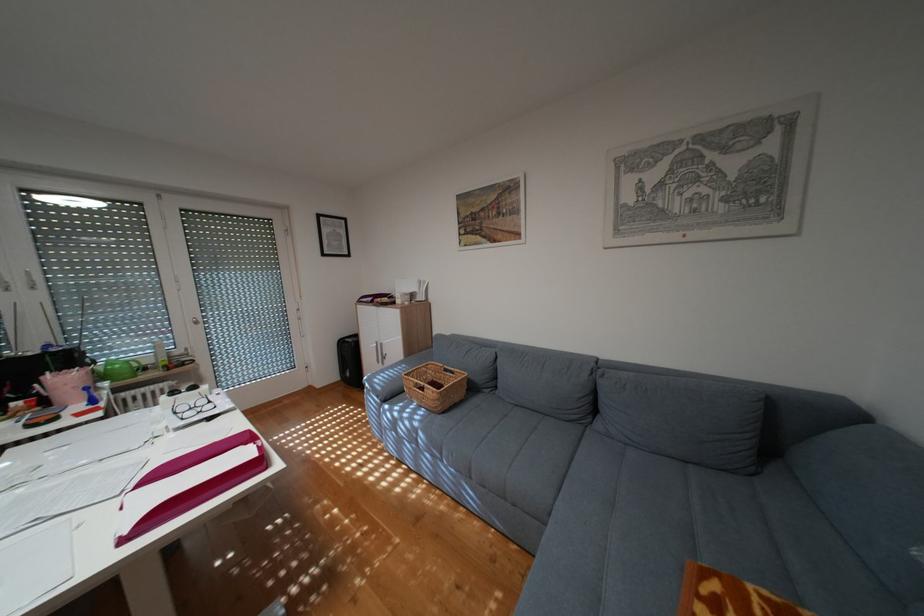
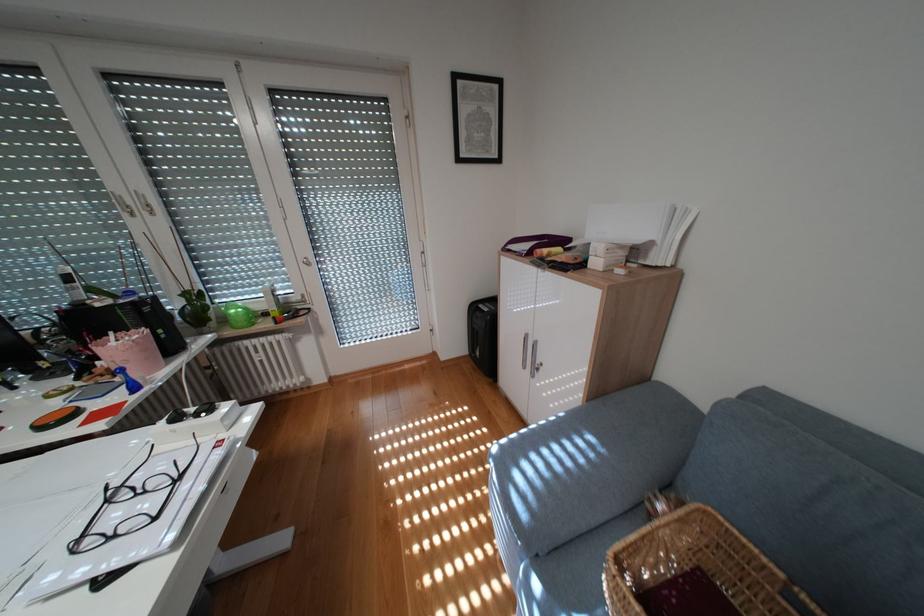
Where in the second image is the point corresponding to [187,411] from the first image?

(119, 501)